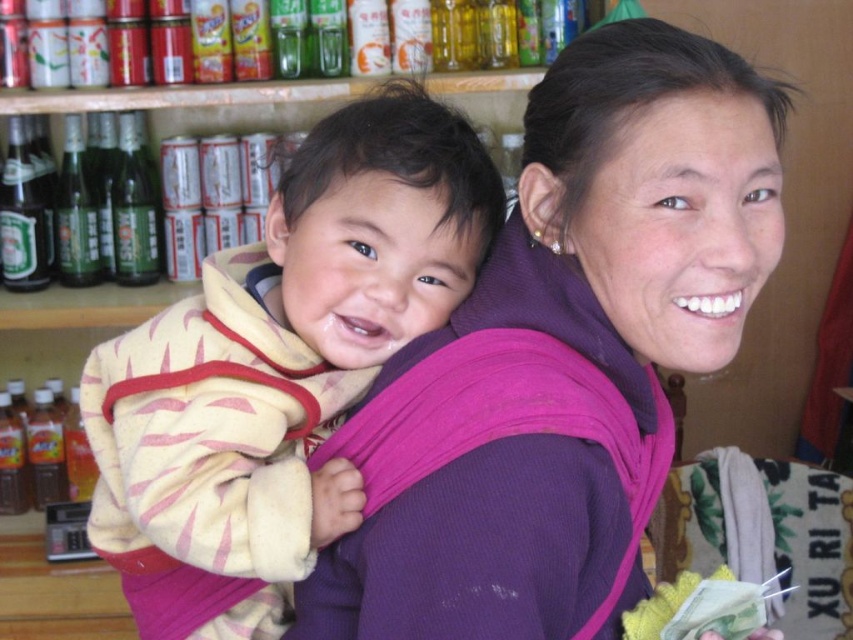
Who is shorter, green glass bottle at upper left or green glass bottle at left?

Standing shorter between the two is green glass bottle at upper left.

Is green glass bottle at upper left positioned in front of green glass bottle at left?

That is False.

Image resolution: width=853 pixels, height=640 pixels. What do you see at coordinates (134, 211) in the screenshot?
I see `green glass bottle at upper left` at bounding box center [134, 211].

Where is `green glass bottle at upper left`? green glass bottle at upper left is located at coordinates (134, 211).

Which of these two, purple fabric carrier at center or green glass bottle at upper left, stands shorter?

Standing shorter between the two is green glass bottle at upper left.

Looking at this image, between purple fabric carrier at center and green glass bottle at upper left, which one appears on the left side from the viewer's perspective?

green glass bottle at upper left is more to the left.

Measure the distance between purple fabric carrier at center and camera.

They are 25.62 inches apart.

Locate an element on the screen. The image size is (853, 640). purple fabric carrier at center is located at coordinates (635, 209).

Does yellow fleece baby at center lie in front of green glass bottle at upper left?

Yes, yellow fleece baby at center is closer to the viewer.

Is yellow fleece baby at center below green glass bottle at upper left?

Yes.

Is point (206, 552) closer to camera compared to point (152, 189)?

Yes, point (206, 552) is closer to viewer.

The image size is (853, 640). In order to click on yellow fleece baby at center in this screenshot , I will do `click(279, 368)`.